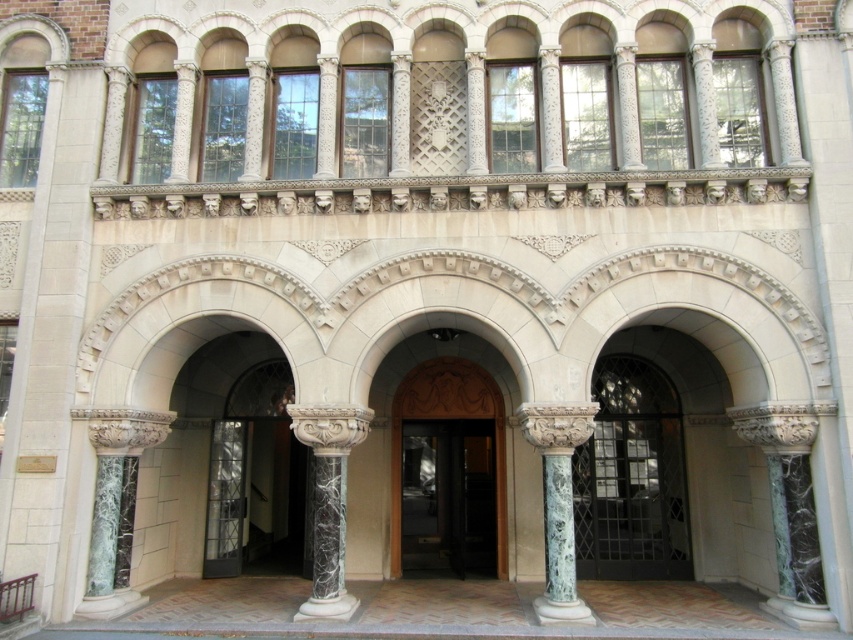
Question: Which object is the farthest from the black glass door at center?

Choices:
 (A) marble column at center
 (B) dark green marble door at center

Answer: (A)

Question: Does marble column at center have a smaller size compared to green marble column at center?

Choices:
 (A) no
 (B) yes

Answer: (A)

Question: Which point is farther from the camera taking this photo?

Choices:
 (A) (335, 483)
 (B) (405, 468)
 (C) (646, 477)

Answer: (B)

Question: Does black glass door at center appear over green marble column at center?

Choices:
 (A) yes
 (B) no

Answer: (B)

Question: Can you confirm if black glass door at center is thinner than green marble column at center?

Choices:
 (A) yes
 (B) no

Answer: (B)

Question: Which point appears closest to the camera in this image?

Choices:
 (A) (442, 440)
 (B) (317, 582)

Answer: (B)